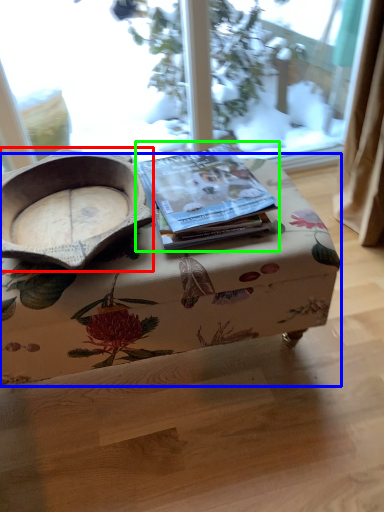
Question: Which object is positioned closest to bowl (highlighted by a red box)? Select from table (highlighted by a blue box) and paperback book (highlighted by a green box).

Choices:
 (A) table
 (B) paperback book

Answer: (B)